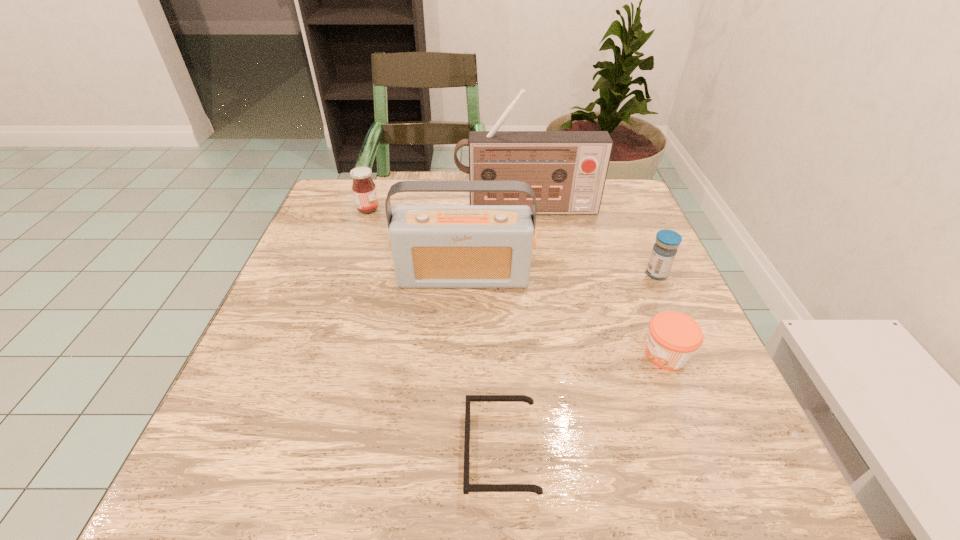
What are the coordinates of `free space at the far edge` in the screenshot? It's located at (422, 198).

This screenshot has height=540, width=960. In order to click on free spot at the near edge of the desktop in this screenshot , I will do `click(646, 451)`.

Image resolution: width=960 pixels, height=540 pixels. In the image, there is a desktop. In order to click on vacant space at the left edge in this screenshot , I will do `click(278, 427)`.

Where is `vacant region at the right edge`? The width and height of the screenshot is (960, 540). vacant region at the right edge is located at coordinates (607, 299).

At what (x,y) coordinates should I click in order to perform the action: click on free space at the far left corner. Please return your answer as a coordinate pair (x, y). The width and height of the screenshot is (960, 540). Looking at the image, I should click on (372, 216).

I want to click on vacant space at the near left corner of the desktop, so click(229, 461).

What are the coordinates of `vacant space at the far right corner of the desktop` in the screenshot? It's located at (620, 204).

Where is `vacant point located between the medicine and the taller radio receiver`? vacant point located between the medicine and the taller radio receiver is located at coordinates (591, 241).

Find the location of `empty space that is in between the tallest object and the medicine`. empty space that is in between the tallest object and the medicine is located at coordinates (591, 241).

Image resolution: width=960 pixels, height=540 pixels. Identify the location of blank region between the second tallest object and the shortest object. (483, 363).